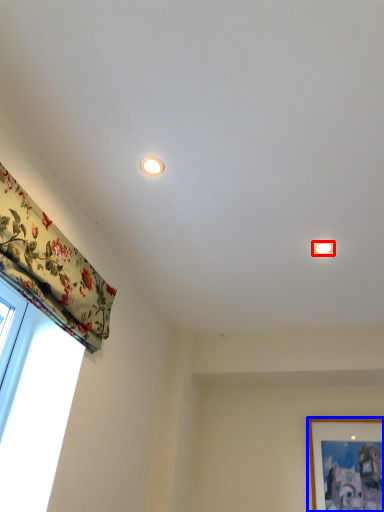
Question: Which of the following is the farthest to the observer, lighting (highlighted by a red box) or picture frame (highlighted by a blue box)?

Choices:
 (A) lighting
 (B) picture frame

Answer: (B)